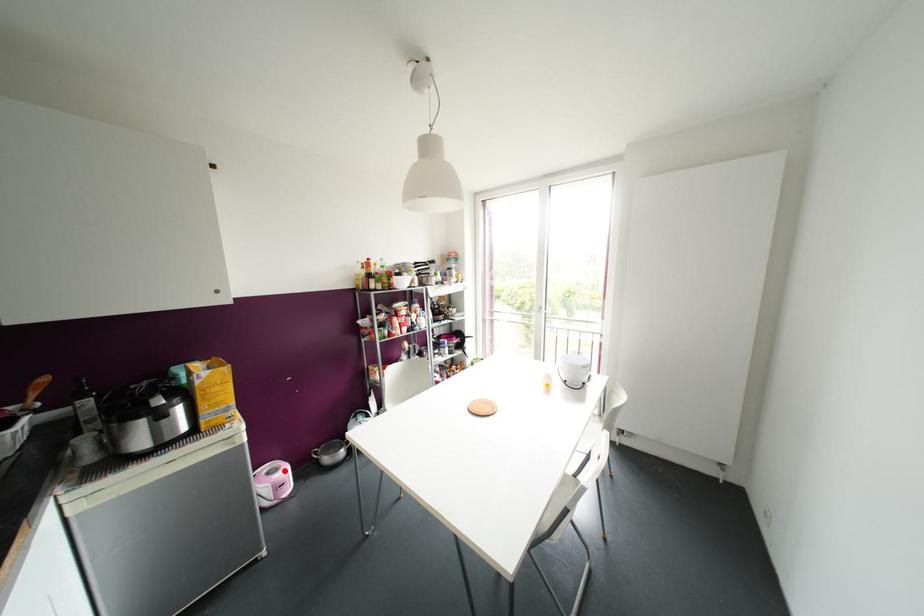
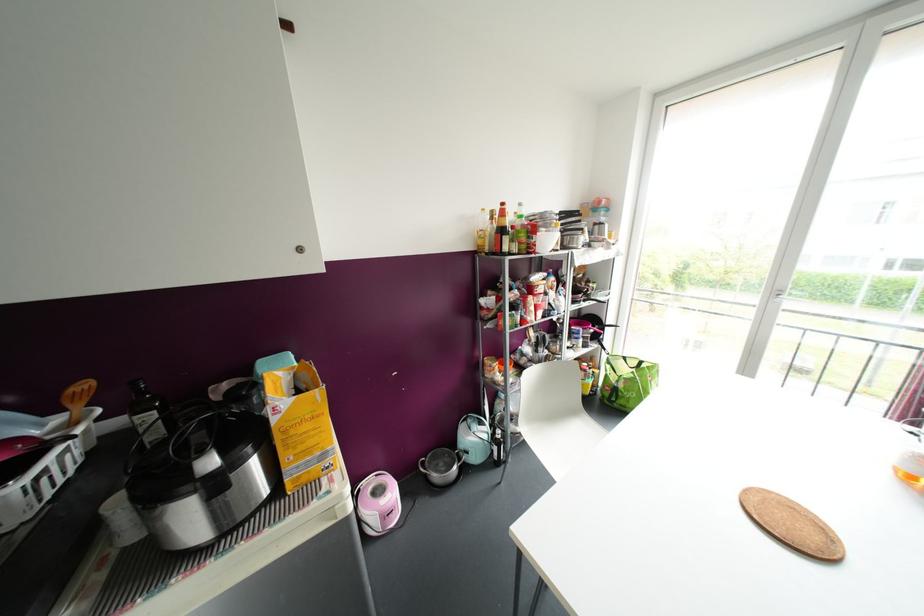
Locate, in the second image, the point that corresponds to the highlighted location in the first image.

(392, 493)